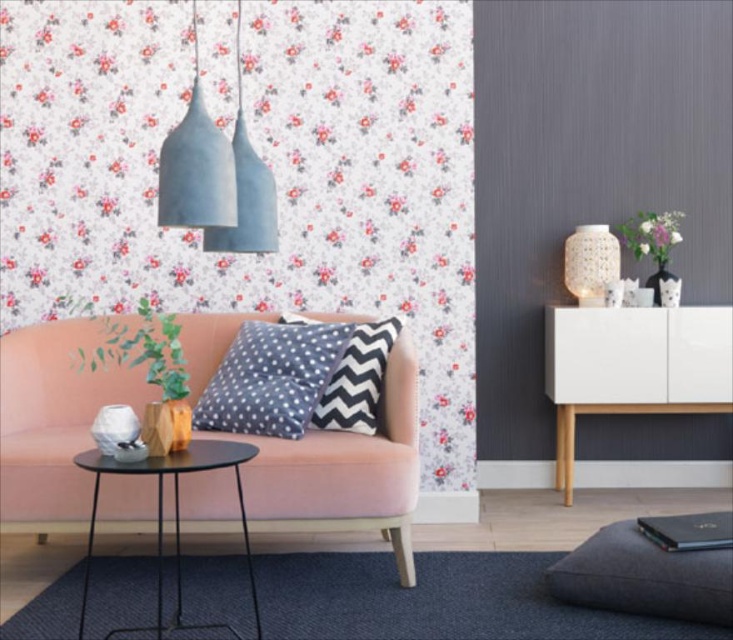
Which is behind, point (410, 467) or point (575, 284)?

The point (575, 284) is more distant.

Who is more distant from viewer, (397, 508) or (586, 228)?

Positioned behind is point (586, 228).

You are a GUI agent. You are given a task and a screenshot of the screen. Output one action in this format:
    pyautogui.click(x=<x>, y=<y>)
    Task: Click on the velvet pink couch at center
    The image size is (733, 640).
    Given the screenshot: What is the action you would take?
    pyautogui.click(x=54, y=422)

Does polka dot fabric pillow at center appear on the right side of black metal side table at lower left?

Indeed, polka dot fabric pillow at center is positioned on the right side of black metal side table at lower left.

Between polka dot fabric pillow at center and black metal side table at lower left, which one has less height?

Standing shorter between the two is polka dot fabric pillow at center.

This screenshot has width=733, height=640. Find the location of `polka dot fabric pillow at center`. polka dot fabric pillow at center is located at coordinates (270, 378).

The height and width of the screenshot is (640, 733). Find the location of `polka dot fabric pillow at center`. polka dot fabric pillow at center is located at coordinates (270, 378).

Is point (383, 372) positioned after point (257, 173)?

Yes, it is.

Locate an element on the screen. black and white zigzag pillow at center is located at coordinates (357, 380).